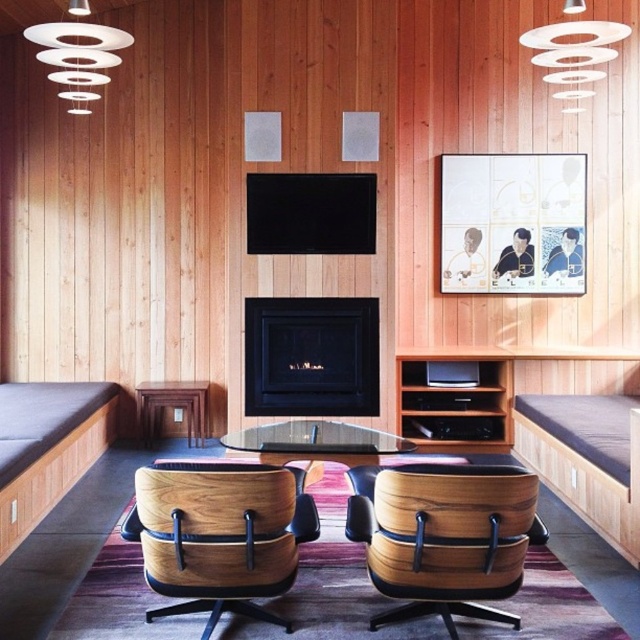
Can you confirm if wooden cushioned bench at right is smaller than transparent glass table at center?

No, wooden cushioned bench at right is not smaller than transparent glass table at center.

Which is behind, point (618, 548) or point (387, 433)?

Positioned behind is point (387, 433).

Where is `wooden cushioned bench at right`? The image size is (640, 640). wooden cushioned bench at right is located at coordinates (586, 460).

Is point (538, 448) positioned in front of point (410, 380)?

Yes, it is in front of point (410, 380).

Describe the element at coordinates (586, 460) in the screenshot. I see `wooden cushioned bench at right` at that location.

Where is `wooden cushioned bench at right`? Image resolution: width=640 pixels, height=640 pixels. wooden cushioned bench at right is located at coordinates (586, 460).

At what (x,y) coordinates should I click in order to perform the action: click on wooden/daybed at center. Please return your answer as a coordinate pair (x, y). The height and width of the screenshot is (640, 640). Looking at the image, I should click on (220, 536).

Is point (371, 534) in front of point (112, 394)?

Yes, point (371, 534) is in front of point (112, 394).

Where is `wooden/daybed at center`? wooden/daybed at center is located at coordinates (220, 536).